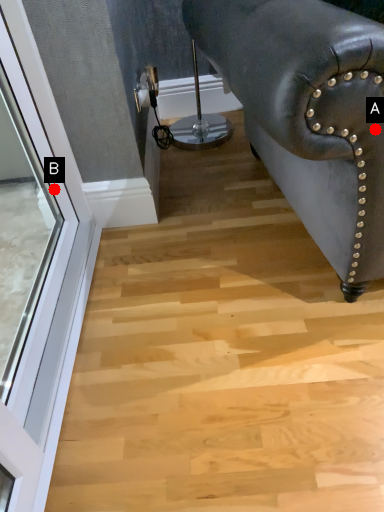
Question: Two points are circled on the image, labeled by A and B beside each circle. Which of the following is the closest to the observer?

Choices:
 (A) A is closer
 (B) B is closer

Answer: (A)